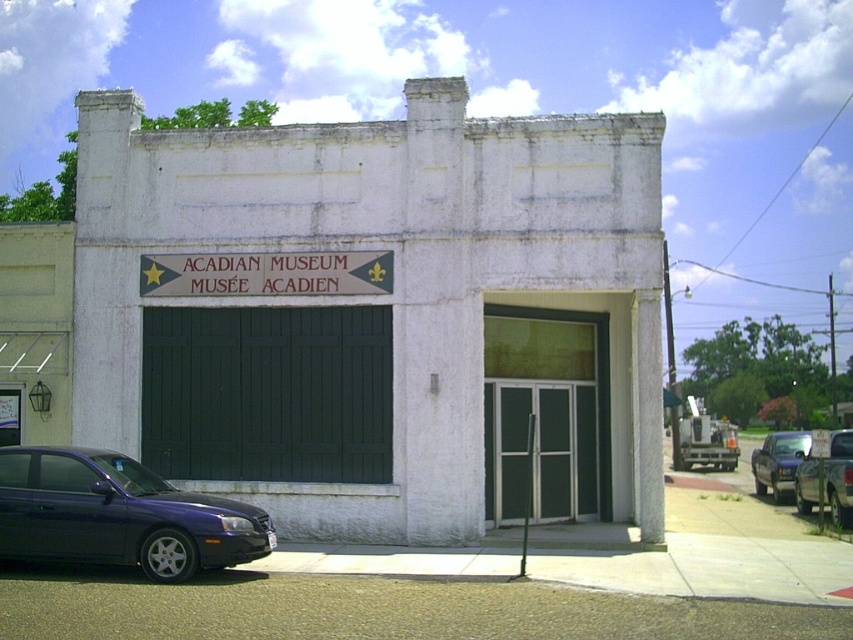
Question: Which of the following is the closest to the observer?

Choices:
 (A) pos(834,445)
 (B) pos(218,282)

Answer: (B)

Question: Considering the relative positions of dark green wooden garage door at center and metallic blue sedan at center in the image provided, where is dark green wooden garage door at center located with respect to metallic blue sedan at center?

Choices:
 (A) left
 (B) right

Answer: (A)

Question: Which of the following is the farthest from the observer?

Choices:
 (A) metallic blue sedan at center
 (B) metallic blue sedan at lower left
 (C) metallic silver truck at lower right

Answer: (A)

Question: Is dark green wooden garage door at center closer to the viewer compared to metallic blue sedan at lower left?

Choices:
 (A) no
 (B) yes

Answer: (A)

Question: Which point appears farthest from the camera in this image?

Choices:
 (A) (822, 461)
 (B) (131, 465)
 (C) (242, 269)
 (D) (772, 490)

Answer: (D)

Question: Can you confirm if dark green wooden garage door at center is positioned to the left of white wooden sign at center?

Choices:
 (A) no
 (B) yes

Answer: (A)